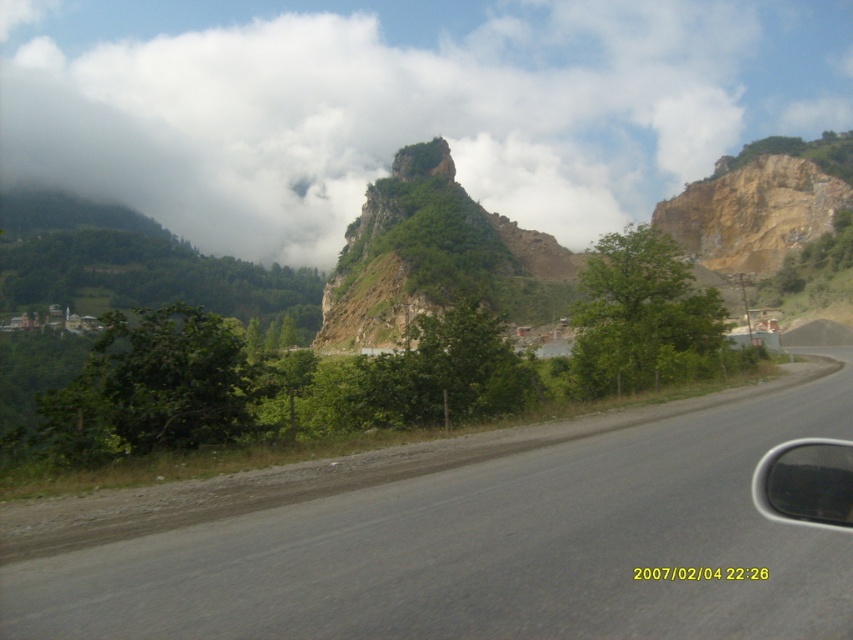
Can you confirm if gray asphalt road at center is positioned to the left of transparent glass car window at right?

Indeed, gray asphalt road at center is positioned on the left side of transparent glass car window at right.

Does gray asphalt road at center have a greater width compared to transparent glass car window at right?

Correct, the width of gray asphalt road at center exceeds that of transparent glass car window at right.

At what (x,y) coordinates should I click in order to perform the action: click on gray asphalt road at center. Please return your answer as a coordinate pair (x, y). Image resolution: width=853 pixels, height=640 pixels. Looking at the image, I should click on (486, 548).

Is white fluffy cloud at upper center in front of gray asphalt road at center?

No, white fluffy cloud at upper center is further to the viewer.

Who is more forward, (569, 152) or (612, 573)?

Positioned in front is point (612, 573).

Locate an element on the screen. white fluffy cloud at upper center is located at coordinates (402, 106).

Does white fluffy cloud at upper center appear over transparent glass car window at right?

Yes.

Who is higher up, white fluffy cloud at upper center or transparent glass car window at right?

Positioned higher is white fluffy cloud at upper center.

You are a GUI agent. You are given a task and a screenshot of the screen. Output one action in this format:
    pyautogui.click(x=<x>, y=<y>)
    Task: Click on the white fluffy cloud at upper center
    
    Given the screenshot: What is the action you would take?
    pyautogui.click(x=402, y=106)